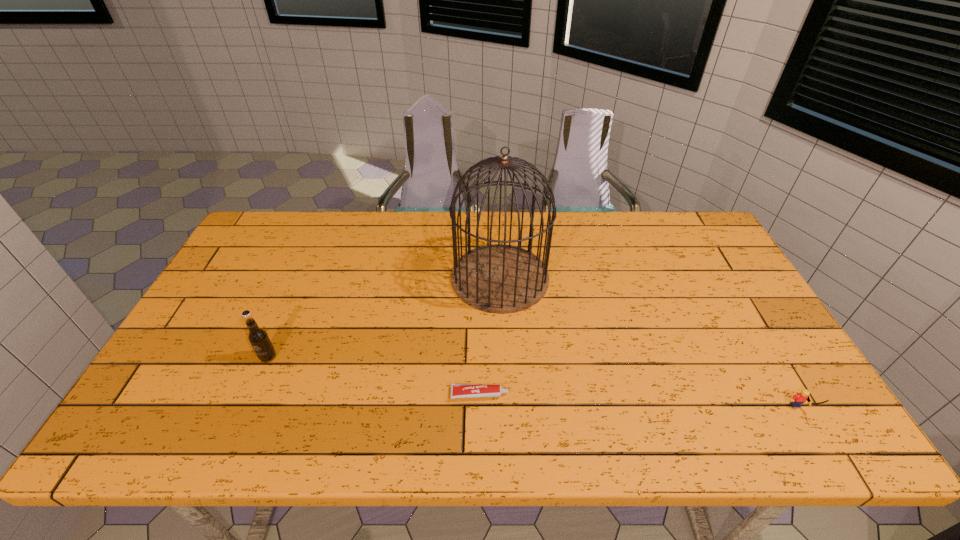
I want to click on vacant space at the right edge of the desktop, so click(x=763, y=364).

In the image, there is a desktop. Where is `free space at the near left corner`? The image size is (960, 540). free space at the near left corner is located at coordinates (130, 440).

Image resolution: width=960 pixels, height=540 pixels. Find the location of `vacant space at the far right corner of the desktop`. vacant space at the far right corner of the desktop is located at coordinates (721, 252).

Identify the location of vacant area that lies between the shortest object and the third shortest object. The width and height of the screenshot is (960, 540). (374, 375).

Where is `free space between the second farthest object and the shortest object`? free space between the second farthest object and the shortest object is located at coordinates (374, 375).

This screenshot has width=960, height=540. I want to click on free space that is in between the third tallest object and the leftmost object, so click(534, 384).

What are the coordinates of `free space between the root beer and the birdcage` in the screenshot? It's located at (384, 318).

Where is `unoccupied area between the birdcage and the shortest object`? This screenshot has width=960, height=540. unoccupied area between the birdcage and the shortest object is located at coordinates (490, 336).

Locate an element on the screen. This screenshot has width=960, height=540. empty space that is in between the shortest object and the birdcage is located at coordinates (490, 336).

This screenshot has width=960, height=540. I want to click on vacant space that's between the third tallest object and the second farthest object, so [534, 384].